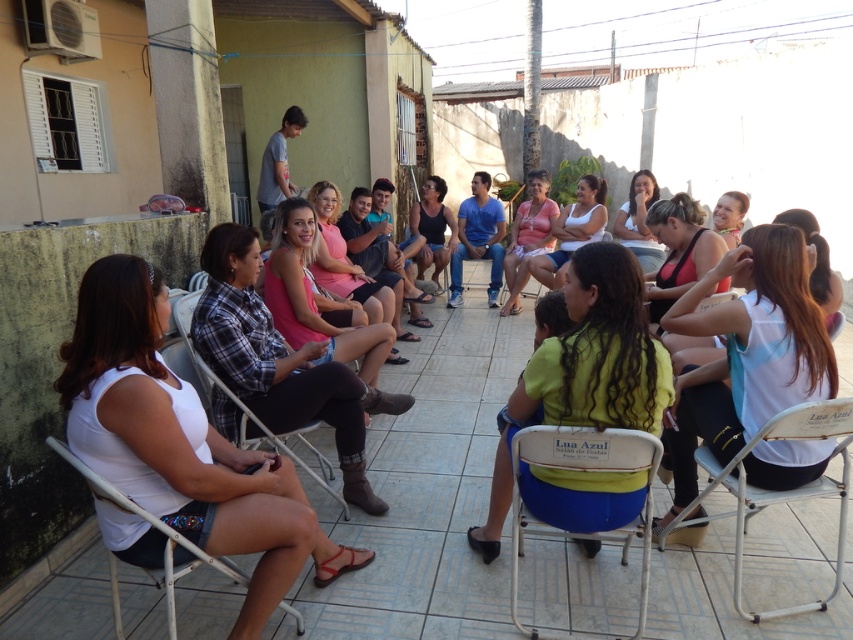
Question: Considering the relative positions of white plastic chair at lower left and metallic silver chair at center in the image provided, where is white plastic chair at lower left located with respect to metallic silver chair at center?

Choices:
 (A) right
 (B) left

Answer: (B)

Question: Can you confirm if metallic silver chair at center is wider than matte pink shirt at upper right?

Choices:
 (A) no
 (B) yes

Answer: (B)

Question: Which of the following is the closest to the observer?

Choices:
 (A) (531, 260)
 (B) (434, 182)

Answer: (A)

Question: Is yellow fabric shirt at center behind pink fabric shirt at center?

Choices:
 (A) no
 (B) yes

Answer: (A)

Question: Among these points, which one is nearest to the camera?

Choices:
 (A) (631, 525)
 (B) (115, 502)
 (C) (651, 237)

Answer: (B)

Question: Which object is closer to the camera taking this photo?

Choices:
 (A) white fabric shirt at lower left
 (B) matte pink shirt at upper right

Answer: (A)